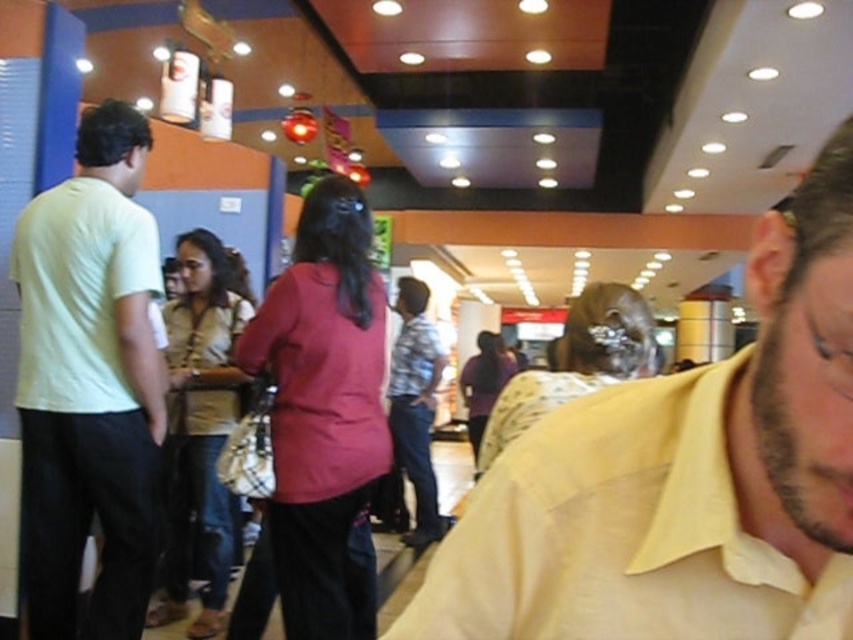
Is yellow cotton shirt at center further to camera compared to plaid cotton shirt at center?

No, it is not.

Does point (556, 576) lie in front of point (422, 515)?

Yes, it is.

At what (x,y) coordinates should I click in order to perform the action: click on yellow cotton shirt at center. Please return your answer as a coordinate pair (x, y). Looking at the image, I should click on (683, 476).

Can you confirm if yellow cotton shirt at center is bigger than light yellow t-shirt at left?

No, yellow cotton shirt at center is not bigger than light yellow t-shirt at left.

Does yellow cotton shirt at center come behind light yellow t-shirt at left?

No, it is in front of light yellow t-shirt at left.

Who is more distant from viewer, (x=822, y=388) or (x=68, y=317)?

Point (x=68, y=317)

I want to click on yellow cotton shirt at center, so click(683, 476).

Does light yellow t-shirt at left lie in front of plaid cotton shirt at center?

Yes, it is.

Is light yellow t-shirt at left above plaid cotton shirt at center?

Yes, light yellow t-shirt at left is above plaid cotton shirt at center.

Which is in front, point (82, 460) or point (404, 301)?

Point (82, 460)

I want to click on light yellow t-shirt at left, so click(x=90, y=384).